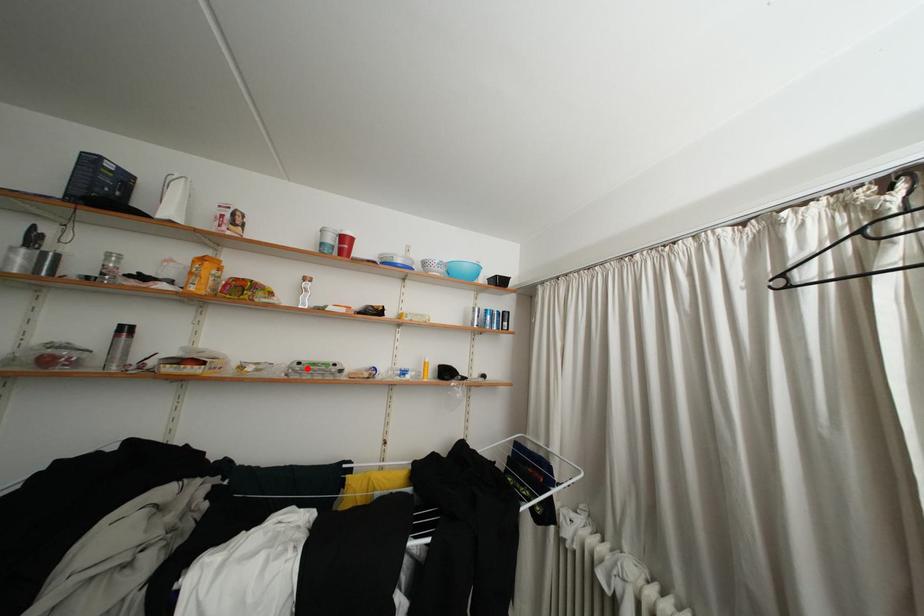
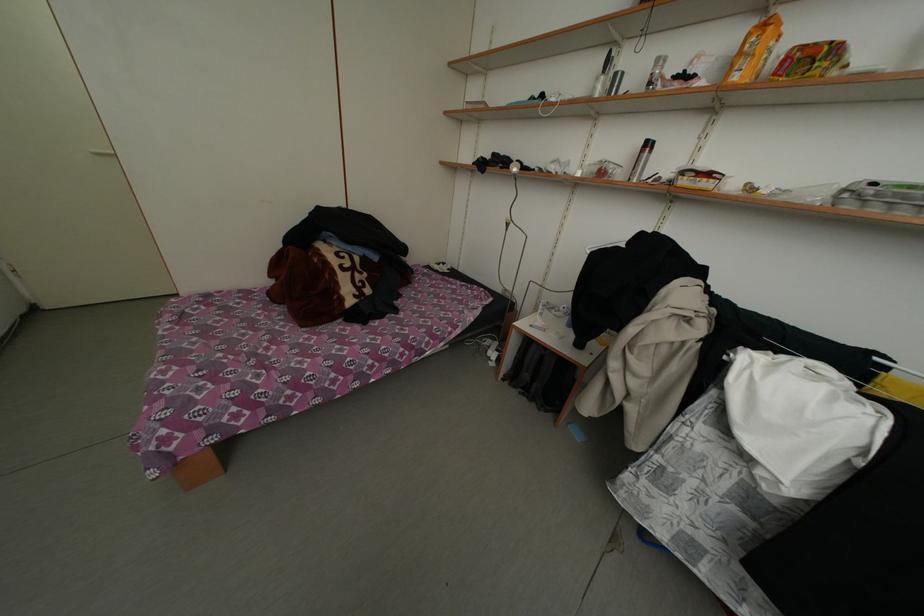
Question: I am providing you with two images of the same scene from different viewpoints. A red point is shown in image1. For the corresponding object point in image2, is it positioned nearer or farther from the camera?

Choices:
 (A) Nearer
 (B) Farther

Answer: (B)